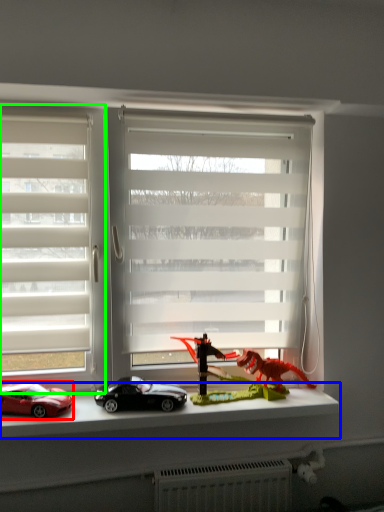
Question: Based on their relative distances, which object is farther from car (highlighted by a red box)? Choose from window sill (highlighted by a blue box) and window (highlighted by a green box).

Choices:
 (A) window sill
 (B) window

Answer: (B)